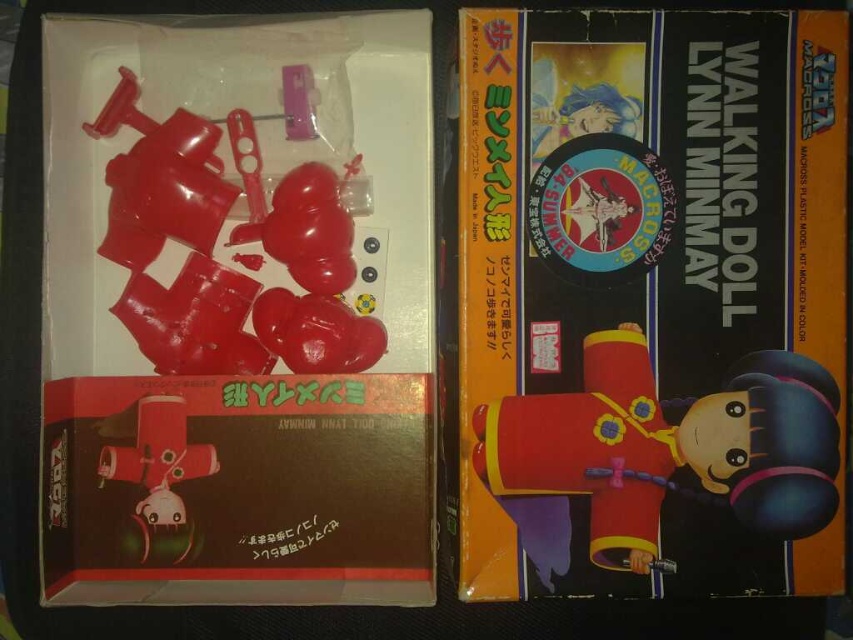
You are examining the packaging of the Walking Doll Lynn Minmay. There are two points marked on the box at coordinates point (518, 396) and point (279, 211). From your viewpoint, which point is nearer to you?

Point (518, 396) is closer to the camera than point (279, 211), so the point nearer to you is point (518, 396).

You are a model kit assembler who just opened the box. You need to locate the parts and the box. According to the image, where is the matte plastic parts at center in relation to the matte plastic box at center?

The matte plastic parts at center are located below the matte plastic box at center.